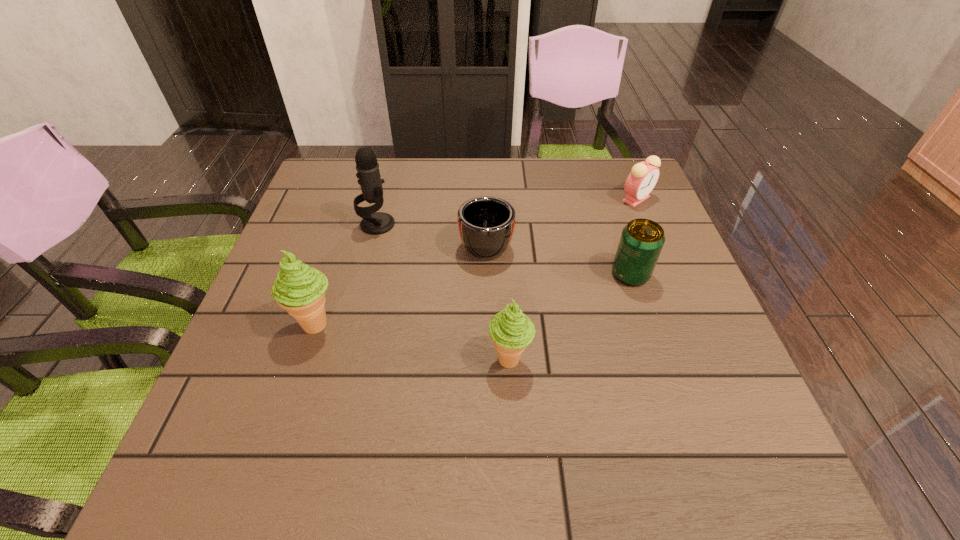
Locate an element on the screen. Image resolution: width=960 pixels, height=540 pixels. object that is at the far right corner is located at coordinates (643, 177).

I want to click on free location at the far edge of the desktop, so click(498, 158).

The image size is (960, 540). I want to click on vacant space at the near edge, so click(x=648, y=378).

Where is `vacant space at the left edge of the desktop`? Image resolution: width=960 pixels, height=540 pixels. vacant space at the left edge of the desktop is located at coordinates (320, 240).

Locate an element on the screen. The image size is (960, 540). vacant space at the right edge of the desktop is located at coordinates (613, 243).

In the image, there is a desktop. Find the location of `vacant region at the far left corner`. vacant region at the far left corner is located at coordinates (343, 179).

This screenshot has width=960, height=540. I want to click on vacant space at the far right corner of the desktop, so click(602, 165).

Find the location of a particular element. The height and width of the screenshot is (540, 960). blank region between the shorter icecream and the left icecream is located at coordinates (413, 342).

In order to click on vacant space in between the mug and the taller icecream in this screenshot , I will do `click(401, 282)`.

What are the coordinates of `free space between the microphone and the shorter icecream` in the screenshot? It's located at (444, 292).